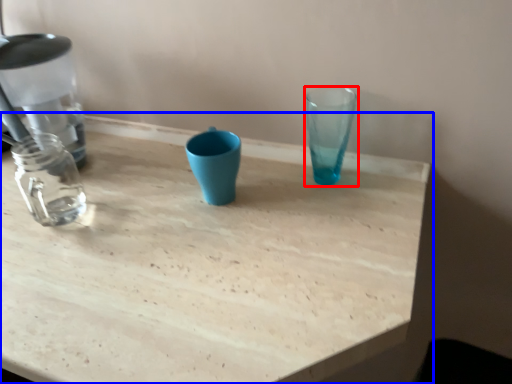
Question: Which object appears farthest to the camera in this image, vase (highlighted by a red box) or table (highlighted by a blue box)?

Choices:
 (A) vase
 (B) table

Answer: (A)